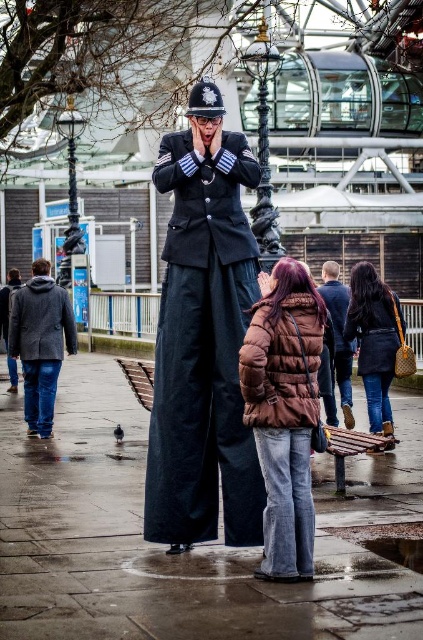
From the picture: Is the position of smooth concrete pavement at center more distant than that of brown puffy jacket at lower center?

That is False.

Is smooth concrete pavement at center bigger than brown puffy jacket at lower center?

Correct, smooth concrete pavement at center is larger in size than brown puffy jacket at lower center.

The image size is (423, 640). What do you see at coordinates (195, 545) in the screenshot?
I see `smooth concrete pavement at center` at bounding box center [195, 545].

Identify the location of smooth concrete pavement at center. This screenshot has width=423, height=640. (195, 545).

Which is in front, point (291, 388) or point (353, 332)?

Point (291, 388) is in front.

Between brown puffy jacket at lower center and leather jacket at lower right, which one appears on the right side from the viewer's perspective?

From the viewer's perspective, leather jacket at lower right appears more on the right side.

Who is more forward, (255, 442) or (387, 385)?

Positioned in front is point (255, 442).

Where is `brown puffy jacket at lower center`? This screenshot has width=423, height=640. brown puffy jacket at lower center is located at coordinates (283, 412).

Between brown puffy jacket at lower center and gray woolen coat at left, which one is positioned higher?

brown puffy jacket at lower center

Is point (282, 323) positioned behind point (60, 289)?

No, (282, 323) is in front of (60, 289).

Where is `brown puffy jacket at lower center`? The image size is (423, 640). brown puffy jacket at lower center is located at coordinates (x=283, y=412).